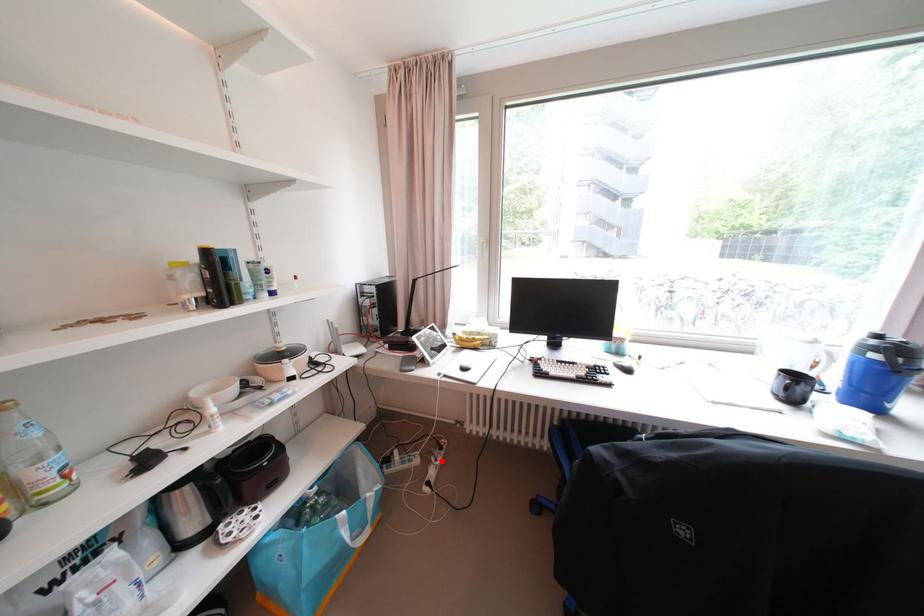
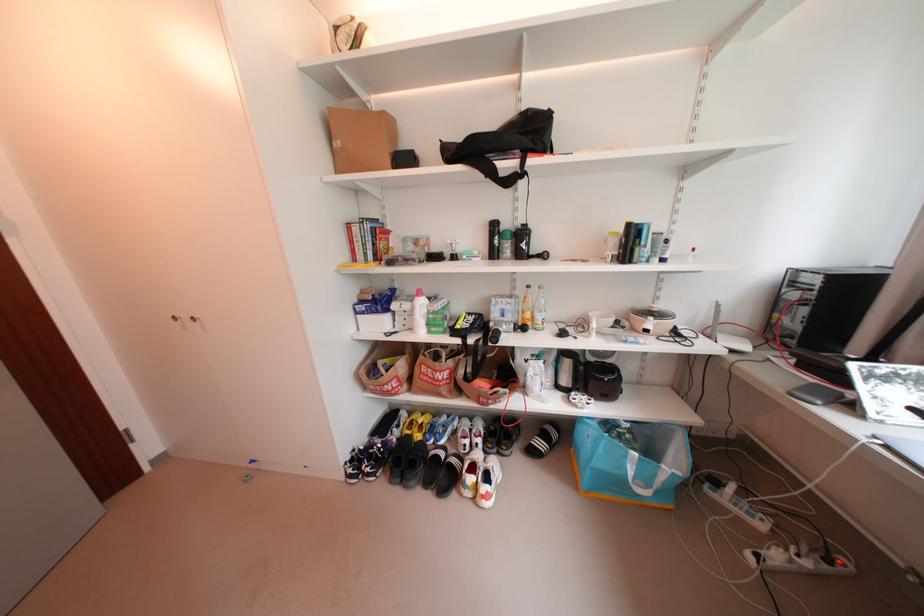
Where in the second image is the point corresponding to the highlighted location from the first image?

(801, 552)